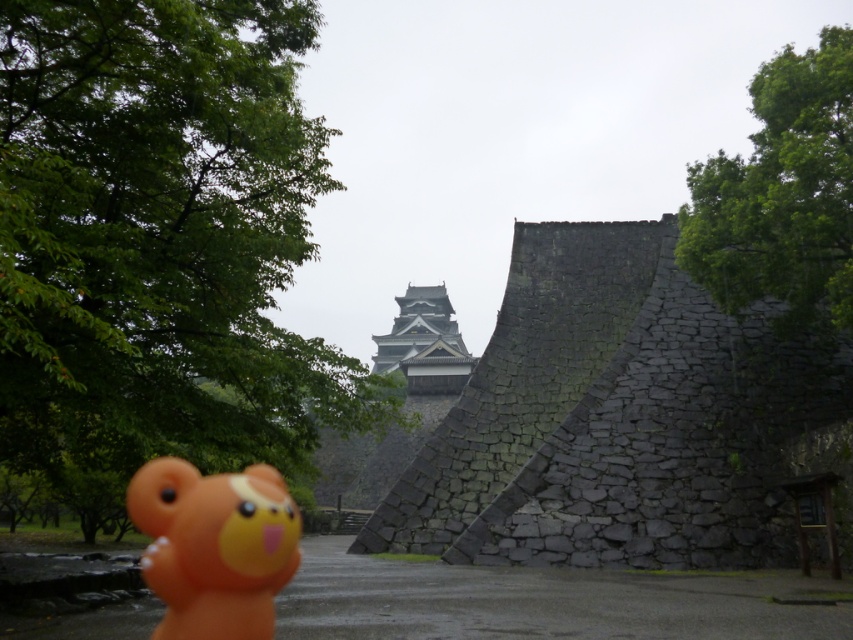
Can you confirm if dark gray stone wall at center is positioned to the left of orange rubber bear at lower left?

In fact, dark gray stone wall at center is to the right of orange rubber bear at lower left.

Between dark gray stone wall at center and orange rubber bear at lower left, which one has less height?

With less height is orange rubber bear at lower left.

Who is more forward, (683,468) or (209,529)?

Point (209,529) is more forward.

Locate an element on the screen. dark gray stone wall at center is located at coordinates click(616, 417).